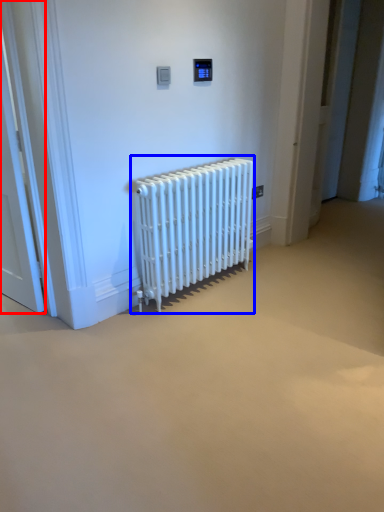
Question: Among these objects, which one is nearest to the camera, door (highlighted by a red box) or radiator (highlighted by a blue box)?

Choices:
 (A) door
 (B) radiator

Answer: (A)